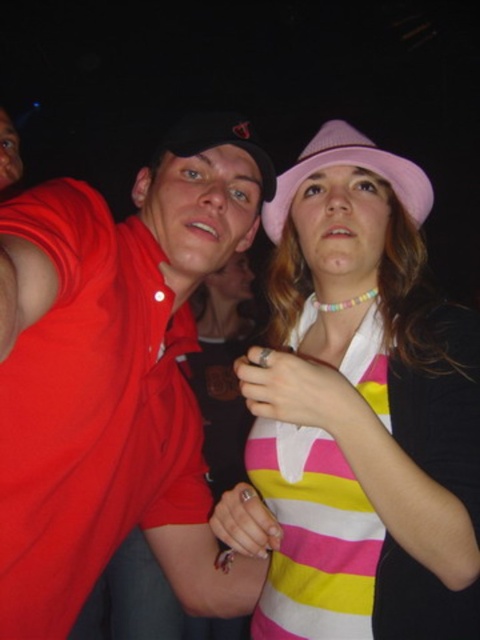
You are organizing a charity event and need to display items based on their size. You have a matte red polo shirt at left and a pink fabric baseball hat at upper center. Which item should you place on the larger display stand to accommodate its size?

The matte red polo shirt at left should be placed on the larger display stand because its width is greater than that of the pink fabric baseball hat at upper center.

You are a photographer at a party and want to ensure both the pink fabric hat at upper center and the pink fabric baseball hat at upper center are clearly visible in your shot. Given that your camera has a minimum focus distance of 12 inches, will you need to adjust your position to capture both hats without blurring?

The distance between the pink fabric hat at upper center and the pink fabric baseball hat at upper center is 13.21 inches. Since this distance is greater than the camera minimum focus distance of 12 inches, you can capture both hats clearly without needing to adjust your position.

You are at a party and want to take a photo of the two people in the scene. The camera you have can only focus on objects within 4 feet. Is the point at coordinate point (232,205) within the camera focus range?

The point at coordinate point (232,205) is 4.11 feet from the camera, which is slightly beyond the camera focus range of 4 feet. Therefore, the camera cannot focus on that point.